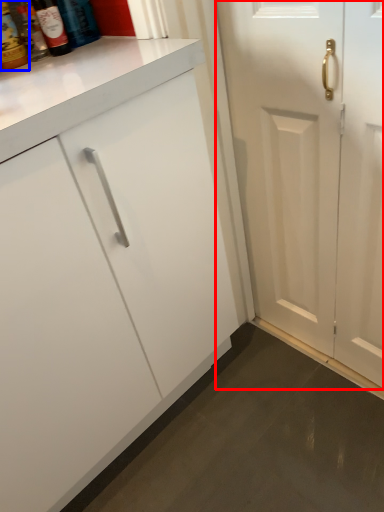
Question: Which object appears farthest to the camera in this image, door (highlighted by a red box) or bottle (highlighted by a blue box)?

Choices:
 (A) door
 (B) bottle

Answer: (B)